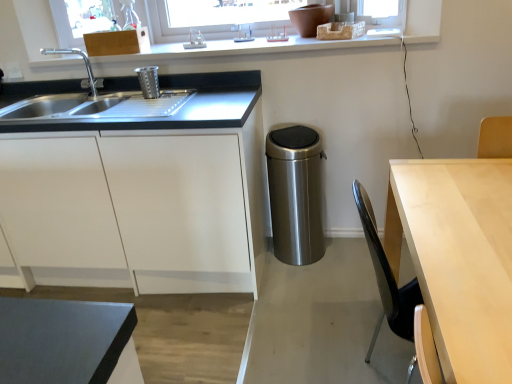
Where is `vacant position to the left of brushed metal trash can at upper left, which is the second appliance in right-to-left order`? The width and height of the screenshot is (512, 384). vacant position to the left of brushed metal trash can at upper left, which is the second appliance in right-to-left order is located at coordinates [x=114, y=104].